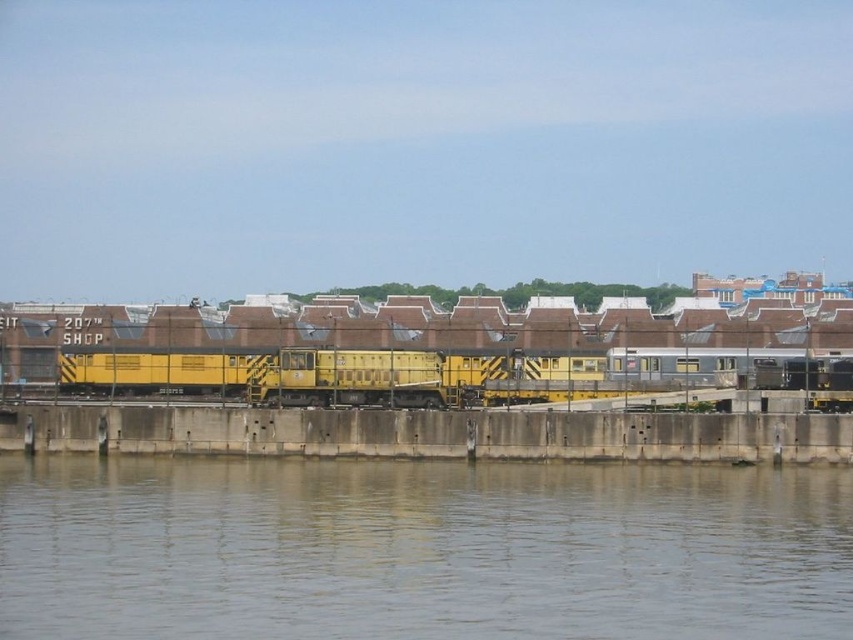
Is concrete at center thinner than yellow matte train at center?

Indeed, concrete at center has a lesser width compared to yellow matte train at center.

Is point (120, 410) farther from viewer compared to point (798, 385)?

No, it is not.

Find the location of a particular element. The image size is (853, 640). concrete at center is located at coordinates (430, 433).

Is gray smooth water at lower center above yellow matte train at center?

Incorrect, gray smooth water at lower center is not positioned above yellow matte train at center.

Can you confirm if gray smooth water at lower center is shorter than yellow matte train at center?

Correct, gray smooth water at lower center is not as tall as yellow matte train at center.

Which is in front, point (717, 596) or point (399, 401)?

Positioned in front is point (717, 596).

The image size is (853, 640). I want to click on gray smooth water at lower center, so click(x=421, y=548).

Is gray smooth water at lower center taller than concrete at center?

Incorrect, gray smooth water at lower center's height is not larger of concrete at center's.

This screenshot has width=853, height=640. I want to click on gray smooth water at lower center, so pyautogui.click(x=421, y=548).